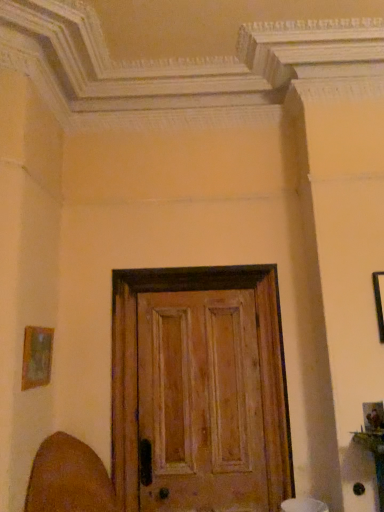
Question: Should I look upward or downward to see wooden frame at left, the first picture frame positioned from the left?

Choices:
 (A) up
 (B) down

Answer: (B)

Question: Can you confirm if wooden frame at left, acting as the second picture frame starting from the right, is smaller than black matte picture frame at upper right, the 2th picture frame positioned from the left?

Choices:
 (A) no
 (B) yes

Answer: (B)

Question: Is wooden frame at left, acting as the second picture frame starting from the right, aimed at black matte picture frame at upper right, the 2th picture frame positioned from the left?

Choices:
 (A) yes
 (B) no

Answer: (A)

Question: Does wooden frame at left, the first picture frame positioned from the left, have a greater height compared to black matte picture frame at upper right, the 2th picture frame positioned from the left?

Choices:
 (A) no
 (B) yes

Answer: (A)

Question: Does wooden frame at left, the first picture frame positioned from the left, have a lesser height compared to black matte picture frame at upper right, the 2th picture frame positioned from the left?

Choices:
 (A) yes
 (B) no

Answer: (A)

Question: Is wooden frame at left, the first picture frame positioned from the left, outside black matte picture frame at upper right, the first picture frame from the right?

Choices:
 (A) yes
 (B) no

Answer: (A)

Question: Is wooden frame at left, the first picture frame positioned from the left, to the right of black matte picture frame at upper right, the 2th picture frame positioned from the left, from the viewer's perspective?

Choices:
 (A) no
 (B) yes

Answer: (A)

Question: Is black matte picture frame at upper right, the first picture frame from the right, positioned with its back to wooden frame at left, the first picture frame positioned from the left?

Choices:
 (A) yes
 (B) no

Answer: (B)

Question: Considering the relative sizes of black matte picture frame at upper right, the 2th picture frame positioned from the left, and wooden frame at left, acting as the second picture frame starting from the right, in the image provided, is black matte picture frame at upper right, the 2th picture frame positioned from the left, shorter than wooden frame at left, acting as the second picture frame starting from the right,?

Choices:
 (A) yes
 (B) no

Answer: (B)

Question: Does black matte picture frame at upper right, the first picture frame from the right, come in front of wooden frame at left, acting as the second picture frame starting from the right?

Choices:
 (A) yes
 (B) no

Answer: (B)

Question: From the image's perspective, is black matte picture frame at upper right, the 2th picture frame positioned from the left, below wooden frame at left, the first picture frame positioned from the left?

Choices:
 (A) yes
 (B) no

Answer: (B)

Question: Is black matte picture frame at upper right, the first picture frame from the right, bigger than wooden frame at left, acting as the second picture frame starting from the right?

Choices:
 (A) no
 (B) yes

Answer: (B)

Question: From a real-world perspective, is black matte picture frame at upper right, the 2th picture frame positioned from the left, on wooden frame at left, the first picture frame positioned from the left?

Choices:
 (A) no
 (B) yes

Answer: (B)

Question: Is brown leather swivel chair at lower left far from black matte picture frame at upper right, the first picture frame from the right?

Choices:
 (A) yes
 (B) no

Answer: (A)